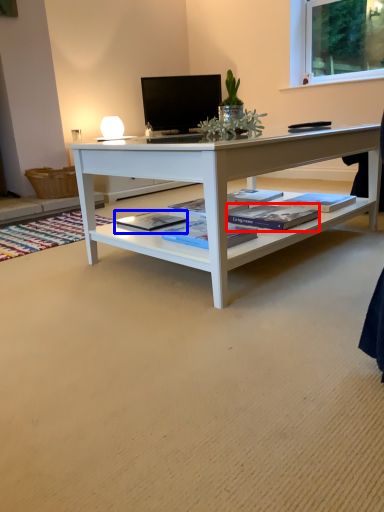
Question: Which object is closer to the camera taking this photo, book (highlighted by a red box) or book (highlighted by a blue box)?

Choices:
 (A) book
 (B) book

Answer: (A)